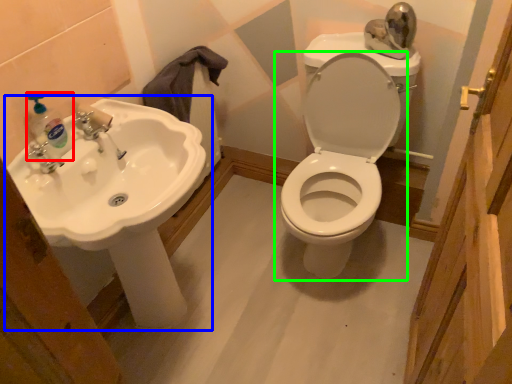
Question: Which object is the farthest from soap dispenser (highlighted by a red box)? Choose among these: sink (highlighted by a blue box) or toilet (highlighted by a green box).

Choices:
 (A) sink
 (B) toilet

Answer: (B)